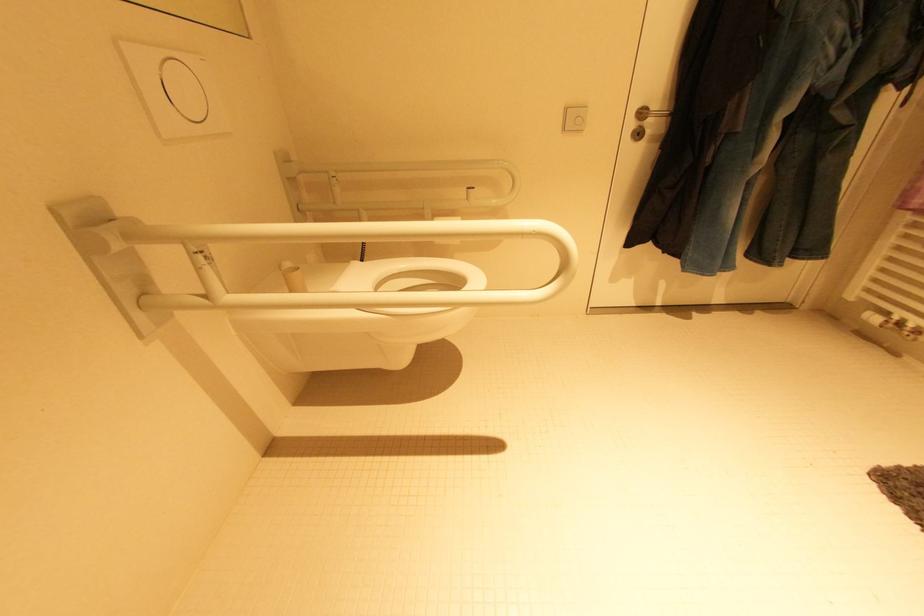
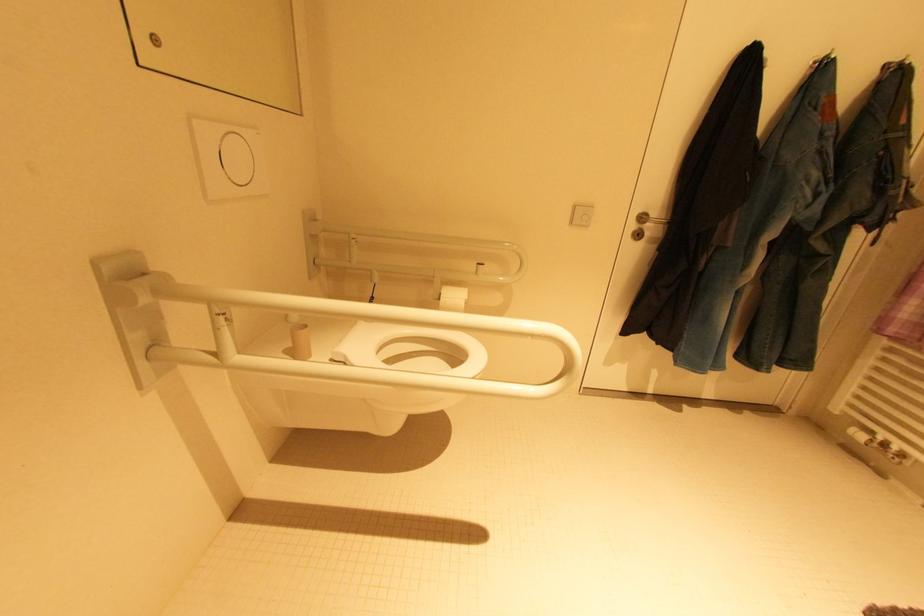
In a continuous first-person perspective shot, in which direction is the camera moving?

The movement direction of the cameraman is left, backward.